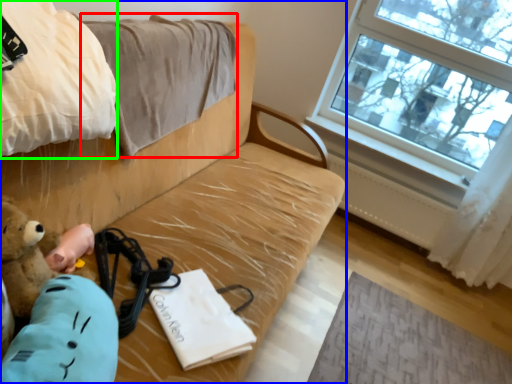
Question: Which object is the farthest from blanket (highlighted by a red box)? Choose among these: studio couch (highlighted by a blue box) or blanket (highlighted by a green box).

Choices:
 (A) studio couch
 (B) blanket

Answer: (B)